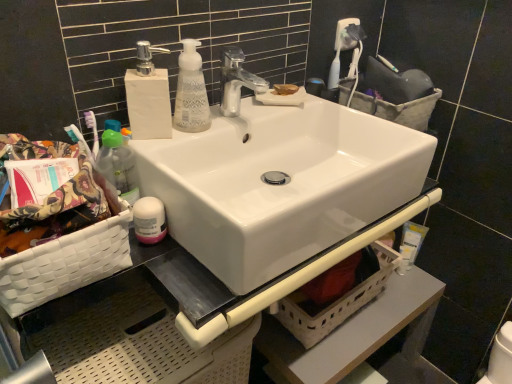
What do you see at coordinates (191, 91) in the screenshot?
I see `clear glass soap dispenser at upper center` at bounding box center [191, 91].

This screenshot has width=512, height=384. What do you see at coordinates (410, 244) in the screenshot? I see `white plastic lotion at right, the first toiletry in the right-to-left sequence` at bounding box center [410, 244].

Measure the distance between white glossy sink at center and camera.

white glossy sink at center is 57.44 centimeters from camera.

The width and height of the screenshot is (512, 384). What do you see at coordinates (338, 298) in the screenshot? I see `beige woven basket at lower center, acting as the 2th basket starting from the left` at bounding box center [338, 298].

Find the location of a particular element. Image resolution: width=512 pixels, height=384 pixels. white matte soap dispenser at upper left is located at coordinates (148, 96).

Where is `white glossy faucet at upper center`? Image resolution: width=512 pixels, height=384 pixels. white glossy faucet at upper center is located at coordinates (236, 81).

Considering the positions of point (116, 134) and point (140, 74), is point (116, 134) closer or farther from the camera than point (140, 74)?

Point (116, 134) appears to be closer to the viewer than point (140, 74).

Which of these two, translucent plastic bottle at left or white matte soap dispenser at upper left, is thinner?

translucent plastic bottle at left is thinner.

Could you tell me if translucent plastic bottle at left is turned towards white matte soap dispenser at upper left?

No, translucent plastic bottle at left is not turned towards white matte soap dispenser at upper left.

Is translucent plastic bottle at left next to white matte soap dispenser at upper left and touching it?

Yes, translucent plastic bottle at left is next to white matte soap dispenser at upper left.

Does white woven basket at lower left, arranged as the 3th basket when viewed from the back, turn towards white plastic lotion at right, which is counted as the 2th toiletry, starting from the front?

No, white woven basket at lower left, arranged as the 3th basket when viewed from the back, is not oriented towards white plastic lotion at right, which is counted as the 2th toiletry, starting from the front.

Is white woven basket at lower left, which is the second basket from bottom to top, shorter than white plastic lotion at right, arranged as the second toiletry when viewed from the left?

No.

In terms of width, does white woven basket at lower left, which is the first basket in front-to-back order, look wider or thinner when compared to white plastic lotion at right, arranged as the second toiletry when viewed from the left?

Clearly, white woven basket at lower left, which is the first basket in front-to-back order, has more width compared to white plastic lotion at right, arranged as the second toiletry when viewed from the left.

Is white matte soap dispenser at upper left at the right side of clear glass soap dispenser at upper center?

Incorrect, white matte soap dispenser at upper left is not on the right side of clear glass soap dispenser at upper center.

Considering the sizes of objects white matte soap dispenser at upper left and clear glass soap dispenser at upper center in the image provided, who is smaller, white matte soap dispenser at upper left or clear glass soap dispenser at upper center?

Smaller between the two is clear glass soap dispenser at upper center.

Would you consider white matte soap dispenser at upper left to be distant from clear glass soap dispenser at upper center?

No, there isn't a large distance between white matte soap dispenser at upper left and clear glass soap dispenser at upper center.

Is clear glass soap dispenser at upper center at the back of white matte soap dispenser at upper left?

No.

From a real-world perspective, which object stands above the other?

From a 3D spatial view, clear glass soap dispenser at upper center is above.

Between beige fabric basket at upper right, the third basket positioned from the left, and clear glass soap dispenser at upper center, which one is positioned in front?

clear glass soap dispenser at upper center is more forward.

Is beige fabric basket at upper right, the third basket positioned from the left, turned away from clear glass soap dispenser at upper center?

That's not correct — beige fabric basket at upper right, the third basket positioned from the left, is not looking away from clear glass soap dispenser at upper center.

Between beige fabric basket at upper right, the third basket positioned from the left, and clear glass soap dispenser at upper center, which one has larger width?

beige fabric basket at upper right, the third basket positioned from the left, is wider.

Considering the sizes of objects clear glass soap dispenser at upper center and white glossy faucet at upper center in the image provided, who is shorter, clear glass soap dispenser at upper center or white glossy faucet at upper center?

With less height is white glossy faucet at upper center.

Which of these two, clear glass soap dispenser at upper center or white glossy faucet at upper center, is thinner?

With smaller width is clear glass soap dispenser at upper center.

Locate an element on the screen. cleaning product below the white glossy faucet at upper center (from the image's perspective) is located at coordinates (191, 91).

Can white glossy faucet at upper center be found inside pink glossy lotion at lower left, acting as the second toiletry starting from the back?

Definitely not — white glossy faucet at upper center is not inside pink glossy lotion at lower left, acting as the second toiletry starting from the back.

Considering the sizes of objects pink glossy lotion at lower left, which is the 1th toiletry from front to back, and white glossy faucet at upper center in the image provided, who is bigger, pink glossy lotion at lower left, which is the 1th toiletry from front to back, or white glossy faucet at upper center?

With larger size is white glossy faucet at upper center.

From a real-world perspective, is pink glossy lotion at lower left, which ranks as the 1th toiletry in left-to-right order, on top of white glossy faucet at upper center?

No.

Would you consider pink glossy lotion at lower left, which is the 1th toiletry from front to back, to be distant from white glossy faucet at upper center?

No, pink glossy lotion at lower left, which is the 1th toiletry from front to back, is not far from white glossy faucet at upper center.

Relative to white plastic lotion at right, the first toiletry in the right-to-left sequence, is white matte soap dispenser at upper left in front or behind?

Clearly, white matte soap dispenser at upper left is in front of white plastic lotion at right, the first toiletry in the right-to-left sequence.

In terms of width, does white matte soap dispenser at upper left look wider or thinner when compared to white plastic lotion at right, arranged as the first toiletry when viewed from the back?

In the image, white matte soap dispenser at upper left appears to be wider than white plastic lotion at right, arranged as the first toiletry when viewed from the back.

From a real-world perspective, which is physically below, white matte soap dispenser at upper left or white plastic lotion at right, arranged as the second toiletry when viewed from the left?

white plastic lotion at right, arranged as the second toiletry when viewed from the left.

Measure the distance from white matte soap dispenser at upper left to white plastic lotion at right, which is counted as the 2th toiletry, starting from the front.

They are 35.97 inches apart.

The height and width of the screenshot is (384, 512). In order to click on bottle below the white matte soap dispenser at upper left (from the image's perspective) in this screenshot , I will do `click(119, 165)`.

Image resolution: width=512 pixels, height=384 pixels. There is a white plastic lotion at right, the first toiletry in the right-to-left sequence. What are the coordinates of `the 2nd basket above it (from a real-world perspective)` in the screenshot? It's located at (65, 264).

Looking at the image, which one is located further to white glossy sink at center, beige woven basket at lower center, the first basket positioned from the bottom, or translucent plastic bottle at left?

beige woven basket at lower center, the first basket positioned from the bottom, lies further to white glossy sink at center than the other object.

Estimate the real-world distances between objects in this image. Which object is further from white plastic lotion at right, arranged as the second toiletry when viewed from the left, clear glass soap dispenser at upper center or white glossy faucet at upper center?

clear glass soap dispenser at upper center lies further to white plastic lotion at right, arranged as the second toiletry when viewed from the left, than the other object.

Estimate the real-world distances between objects in this image. Which object is closer to beige fabric basket at upper right, which ranks as the third basket in bottom-to-top order, white glossy faucet at upper center or clear glass soap dispenser at upper center?

Among the two, white glossy faucet at upper center is located nearer to beige fabric basket at upper right, which ranks as the third basket in bottom-to-top order.

Considering their positions, is white woven basket at lower left, marked as the third basket in a right-to-left arrangement, positioned closer to translucent plastic bottle at left than white glossy faucet at upper center?

white woven basket at lower left, marked as the third basket in a right-to-left arrangement.

Estimate the real-world distances between objects in this image. Which object is closer to beige woven basket at lower center, which is the second basket from front to back, translucent plastic bottle at left or white plastic lotion at right, the first toiletry in the right-to-left sequence?

Among the two, white plastic lotion at right, the first toiletry in the right-to-left sequence, is located nearer to beige woven basket at lower center, which is the second basket from front to back.

Estimate the real-world distances between objects in this image. Which object is further from white matte soap dispenser at upper left, translucent plastic bottle at left or white woven basket at lower left, marked as the third basket in a right-to-left arrangement?

Among the two, white woven basket at lower left, marked as the third basket in a right-to-left arrangement, is located further to white matte soap dispenser at upper left.

Looking at the image, which one is located closer to beige fabric basket at upper right, the third basket positioned from the left, white plastic lotion at right, arranged as the first toiletry when viewed from the back, or clear glass soap dispenser at upper center?

white plastic lotion at right, arranged as the first toiletry when viewed from the back.

Considering their positions, is white glossy faucet at upper center positioned further to translucent plastic bottle at left than white plastic lotion at right, arranged as the second toiletry when viewed from the left?

The object further to translucent plastic bottle at left is white plastic lotion at right, arranged as the second toiletry when viewed from the left.

This screenshot has width=512, height=384. Find the location of `cleaning product situated between white matte soap dispenser at upper left and white glossy faucet at upper center from left to right`. cleaning product situated between white matte soap dispenser at upper left and white glossy faucet at upper center from left to right is located at coordinates (191, 91).

Identify the location of tap between pink glossy lotion at lower left, positioned as the 2th toiletry in right-to-left order, and white plastic lotion at right, arranged as the second toiletry when viewed from the left, from left to right. The width and height of the screenshot is (512, 384). (236, 81).

At what (x,y) coordinates should I click in order to perform the action: click on cleaning product between translucent plastic bottle at left and beige fabric basket at upper right, which ranks as the third basket in bottom-to-top order, from left to right. Please return your answer as a coordinate pair (x, y). Image resolution: width=512 pixels, height=384 pixels. Looking at the image, I should click on (191, 91).

The width and height of the screenshot is (512, 384). What are the coordinates of `toiletry situated between translucent plastic bottle at left and white glossy sink at center from left to right` in the screenshot? It's located at (149, 220).